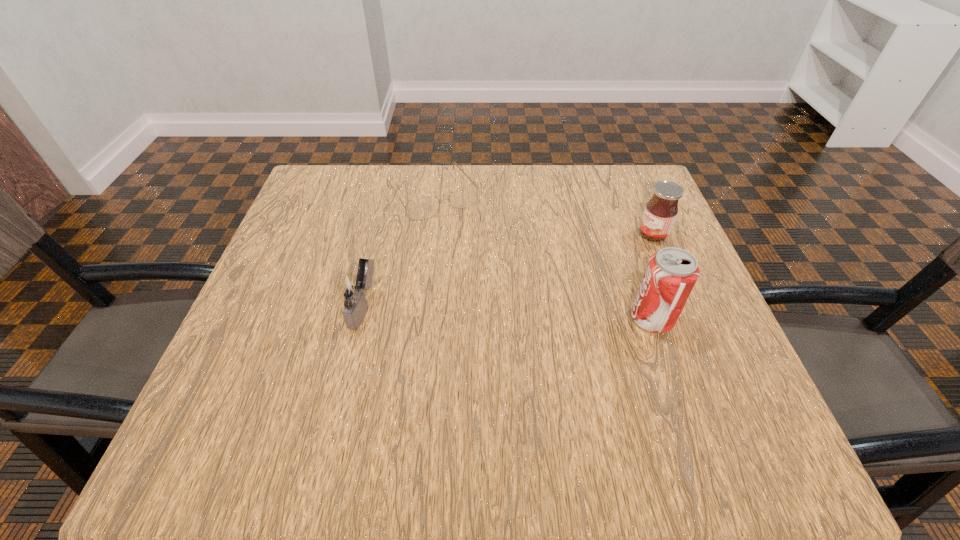
Identify the location of vacant area in the image that satisfies the following two spatial constraints: 1. on the front side of the farthest object; 2. on the left side of the tallest object. The width and height of the screenshot is (960, 540). (416, 319).